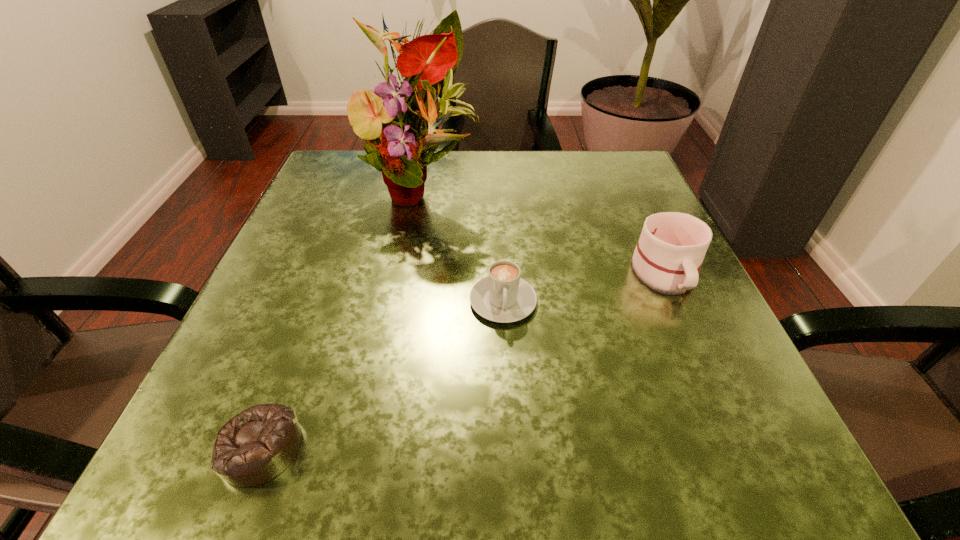
At what (x,y) coordinates should I click in order to perform the action: click on vacant region at the right edge of the desktop. Please return your answer as a coordinate pair (x, y). Looking at the image, I should click on (674, 305).

The height and width of the screenshot is (540, 960). In order to click on free point at the far left corner in this screenshot , I will do `click(333, 153)`.

Locate an element on the screen. Image resolution: width=960 pixels, height=540 pixels. vacant region at the near left corner of the desktop is located at coordinates tap(187, 488).

In order to click on free spot between the shortest object and the tallest object in this screenshot , I will do `click(341, 318)`.

This screenshot has width=960, height=540. In order to click on empty location between the second shortest object and the mug in this screenshot , I will do `click(584, 287)`.

At what (x,y) coordinates should I click in order to perform the action: click on empty space that is in between the rightmost object and the third tallest object. Please return your answer as a coordinate pair (x, y). This screenshot has height=540, width=960. Looking at the image, I should click on (584, 287).

You are a GUI agent. You are given a task and a screenshot of the screen. Output one action in this format:
    pyautogui.click(x=<x>, y=<y>)
    Task: Click on the free spot between the bouquet and the third shortest object
    The height and width of the screenshot is (540, 960).
    Given the screenshot: What is the action you would take?
    pyautogui.click(x=543, y=231)

Find the location of a particular element. This screenshot has height=540, width=960. free space between the shortest object and the second shortest object is located at coordinates (382, 374).

Locate an element on the screen. blank region between the bouquet and the nearest object is located at coordinates (341, 318).

Image resolution: width=960 pixels, height=540 pixels. I want to click on free space that is in between the shortest object and the tallest object, so point(341,318).